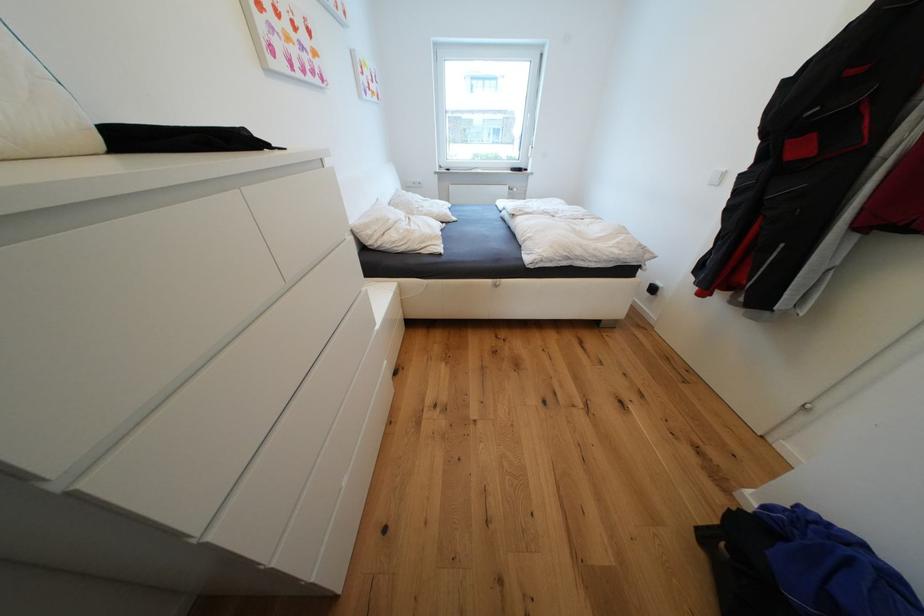
Describe the element at coordinates (715, 177) in the screenshot. Image resolution: width=924 pixels, height=616 pixels. I see `the white light switch` at that location.